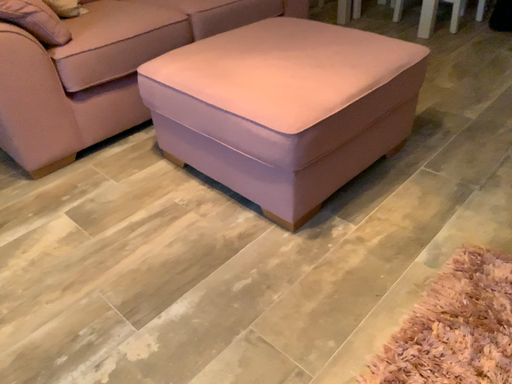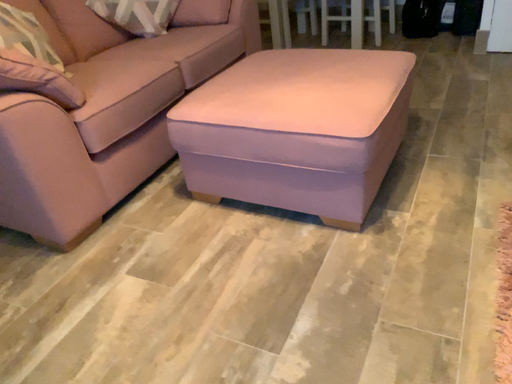
Question: Which way did the camera rotate in the video?

Choices:
 (A) rotated left
 (B) rotated right

Answer: (B)